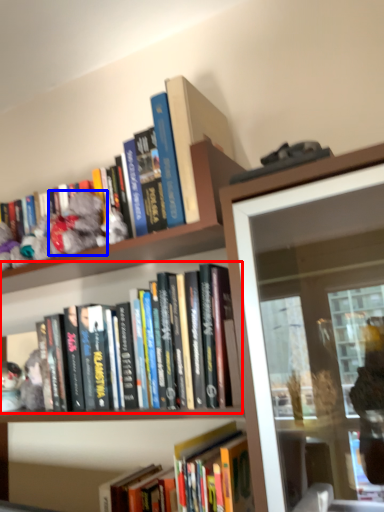
Question: Which object is closer to the camera taking this photo, book (highlighted by a red box) or toy (highlighted by a blue box)?

Choices:
 (A) book
 (B) toy

Answer: (A)